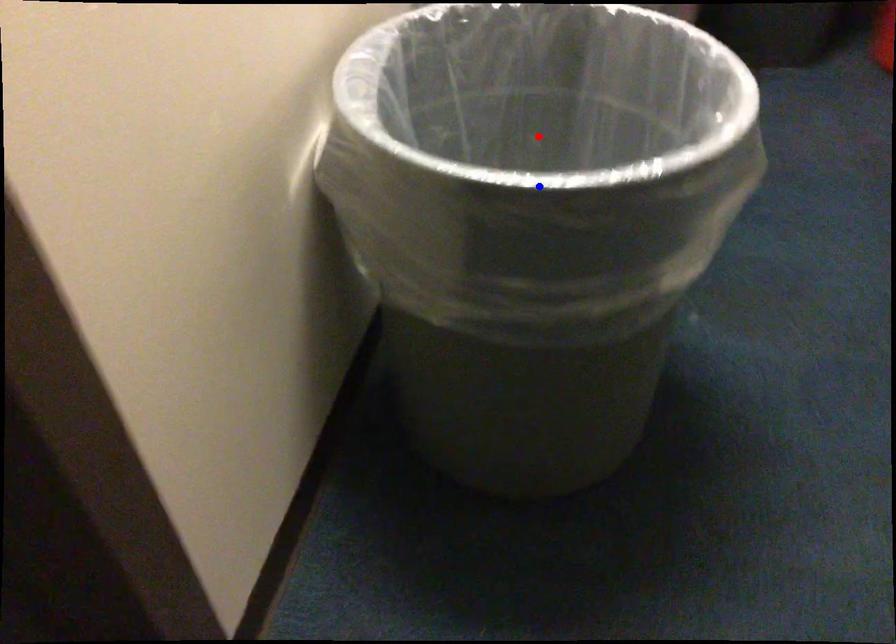
Question: Two points are marked on the image. Which point is closer to the camera?

Choices:
 (A) Blue point is closer.
 (B) Red point is closer.

Answer: (A)